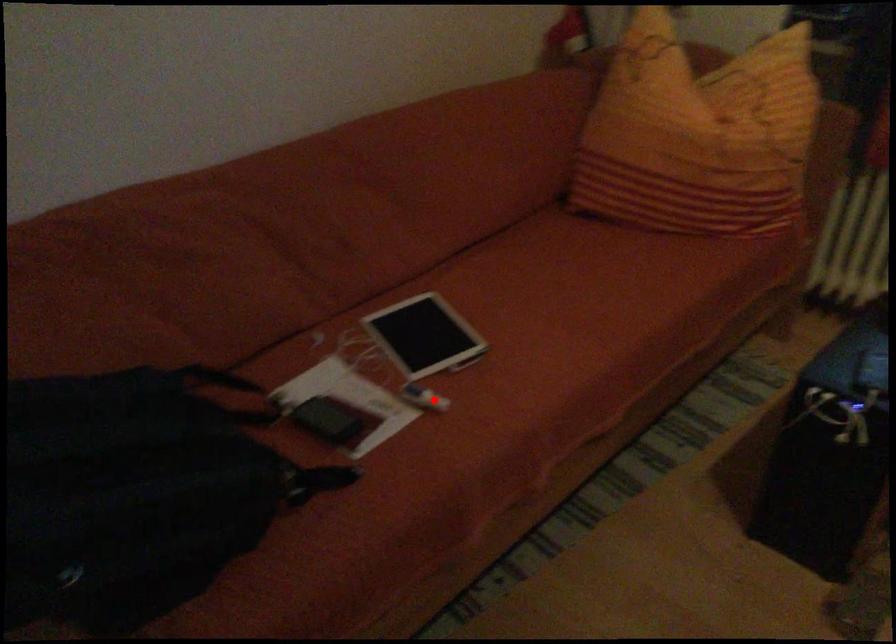
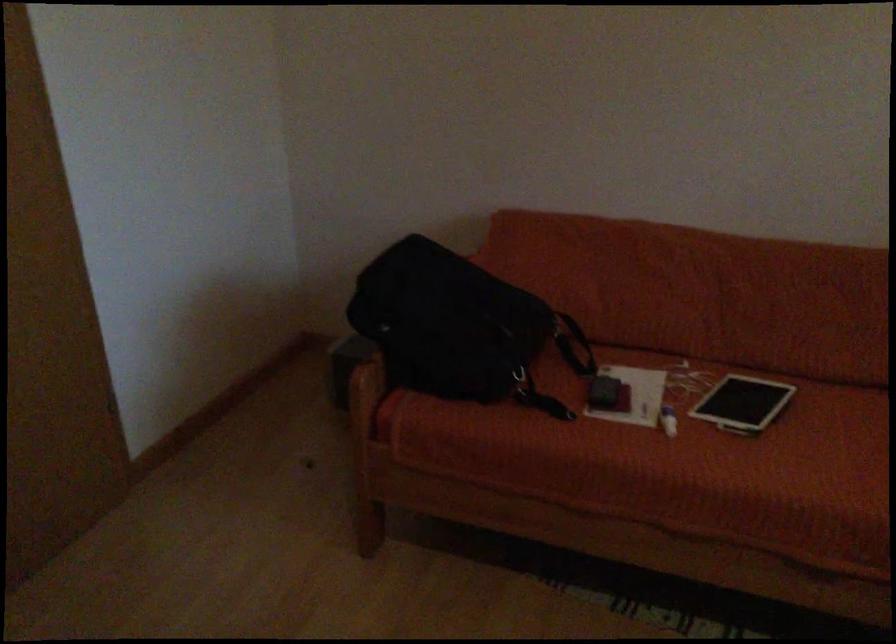
The point at the highlighted location is marked in the first image. Where is the corresponding point in the second image?

(668, 420)